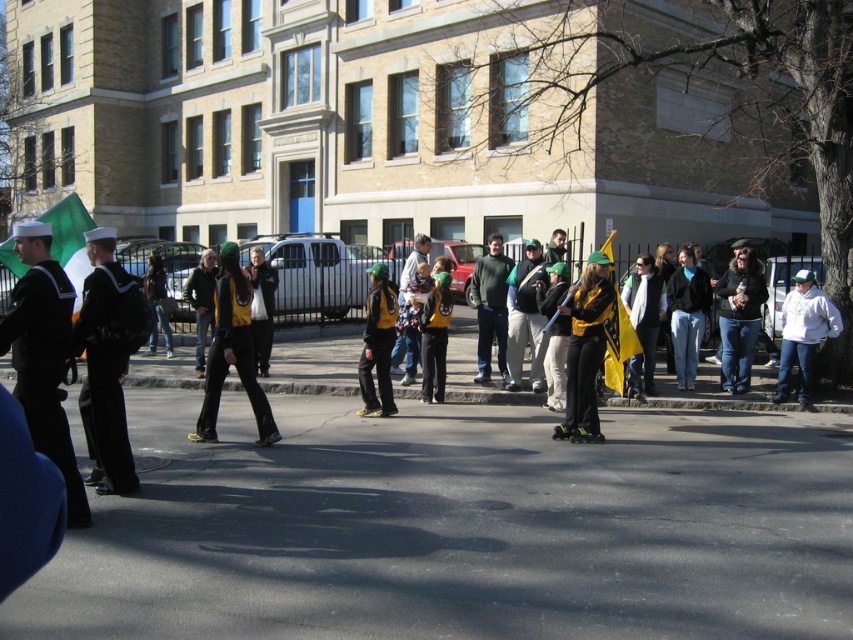
Question: Does matte yellow jacket at center appear under white fleece jacket at right?

Choices:
 (A) yes
 (B) no

Answer: (B)

Question: Estimate the real-world distances between objects in this image. Which object is farther from the white fleece jacket at right?

Choices:
 (A) matte yellow jacket at center
 (B) black rubber roller skate at center
 (C) yellow-green jersey at center

Answer: (C)

Question: Is matte yellow jacket at center smaller than white fleece jacket at right?

Choices:
 (A) no
 (B) yes

Answer: (A)

Question: Estimate the real-world distances between objects in this image. Which object is closer to the matte yellow jacket at center?

Choices:
 (A) black rubber roller skate at center
 (B) yellow-green jersey at center

Answer: (A)

Question: Which point is farther to the camera?

Choices:
 (A) (563, 433)
 (B) (786, 348)
 (C) (585, 292)
 (D) (381, 365)

Answer: (B)

Question: Is yellow-green jersey at center smaller than black rubber roller skate at center?

Choices:
 (A) no
 (B) yes

Answer: (A)